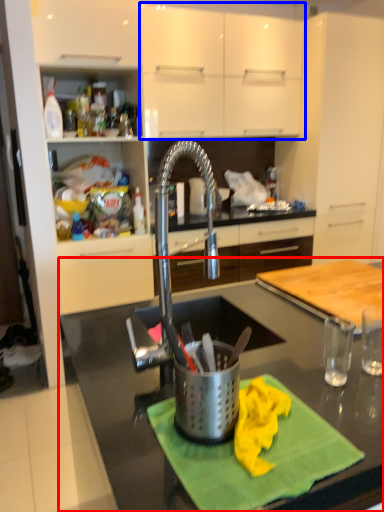
Question: Which point is closer to the camera, countertop (highlighted by a red box) or cabinetry (highlighted by a blue box)?

Choices:
 (A) countertop
 (B) cabinetry

Answer: (A)